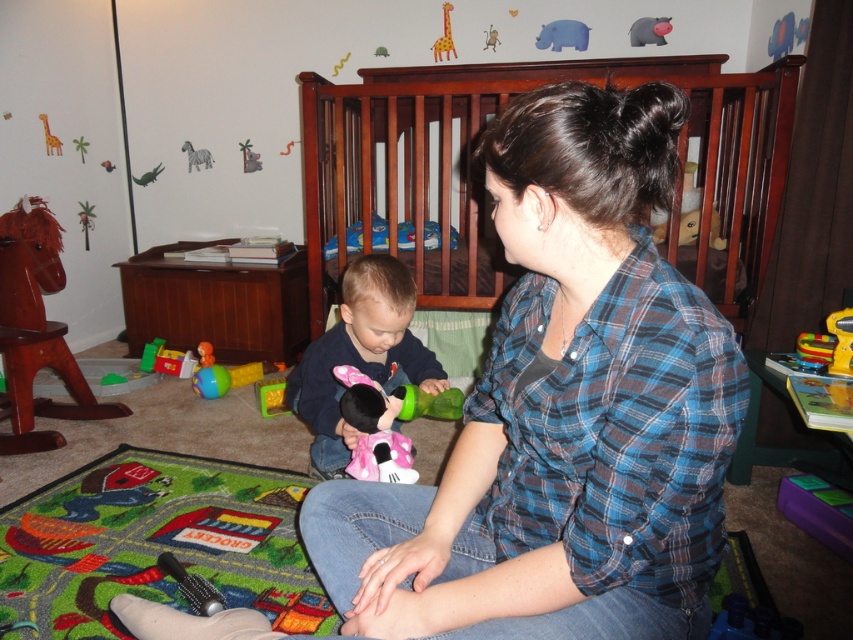
Question: Which point is farther from the camera taking this photo?

Choices:
 (A) tap(440, 42)
 (B) tap(360, 272)

Answer: (A)

Question: Can you confirm if wooden crib at center is thinner than matte pink plush toy at center?

Choices:
 (A) yes
 (B) no

Answer: (B)

Question: Which object appears farthest from the camera in this image?

Choices:
 (A) yellow matte giraffe at upper center
 (B) matte pink plush toy at center
 (C) wooden crib at center

Answer: (A)

Question: Which object is positioned farthest from the yellow matte giraffe at upper center?

Choices:
 (A) matte pink plush toy at center
 (B) wooden crib at center

Answer: (A)

Question: In this image, where is wooden crib at center located relative to yellow matte giraffe at upper center?

Choices:
 (A) left
 (B) right

Answer: (B)

Question: Is wooden crib at center in front of matte pink plush toy at center?

Choices:
 (A) no
 (B) yes

Answer: (A)